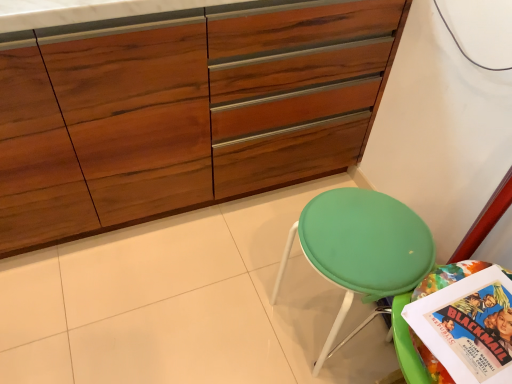
Question: Is wooden cabinet at center in front of or behind green fabric stool at lower right in the image?

Choices:
 (A) behind
 (B) front

Answer: (B)

Question: Based on their positions, is wooden cabinet at center located to the left or right of green fabric stool at lower right?

Choices:
 (A) left
 (B) right

Answer: (A)

Question: Considering the real-world distances, which object is closest to the multicolored paper comic book at lower right?

Choices:
 (A) wooden cabinet at center
 (B) green fabric stool at lower right

Answer: (B)

Question: Which of these objects is positioned farthest from the wooden cabinet at center?

Choices:
 (A) multicolored paper comic book at lower right
 (B) green fabric stool at lower right

Answer: (A)